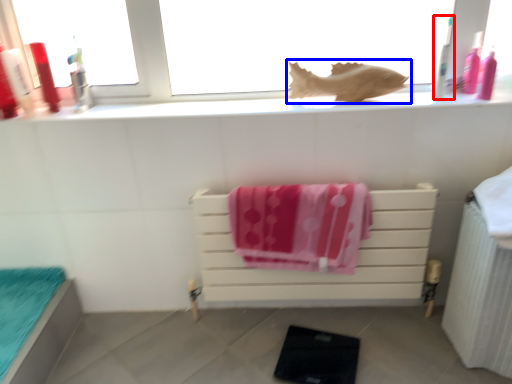
Question: Which point is closer to the camera, toiletry (highlighted by a red box) or animal (highlighted by a blue box)?

Choices:
 (A) toiletry
 (B) animal

Answer: (A)